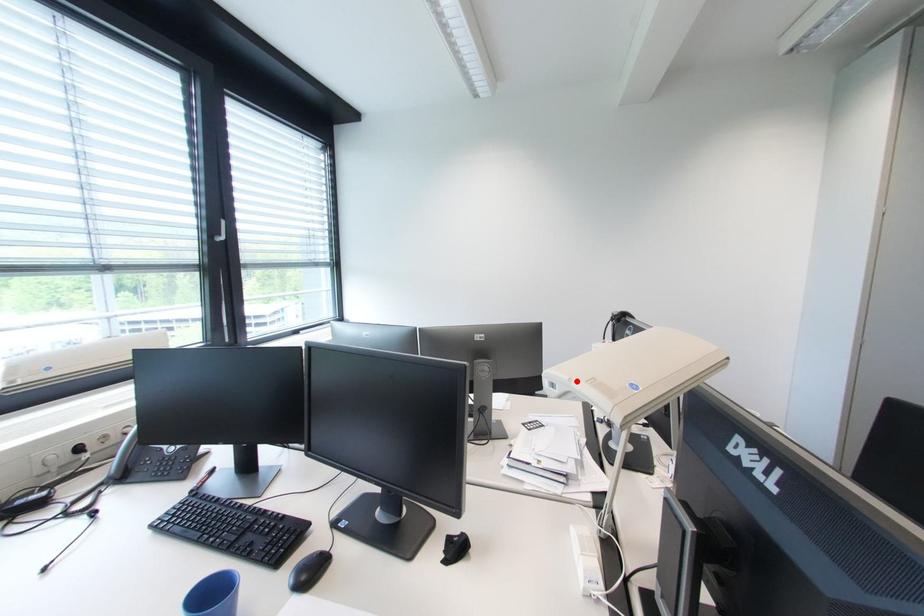
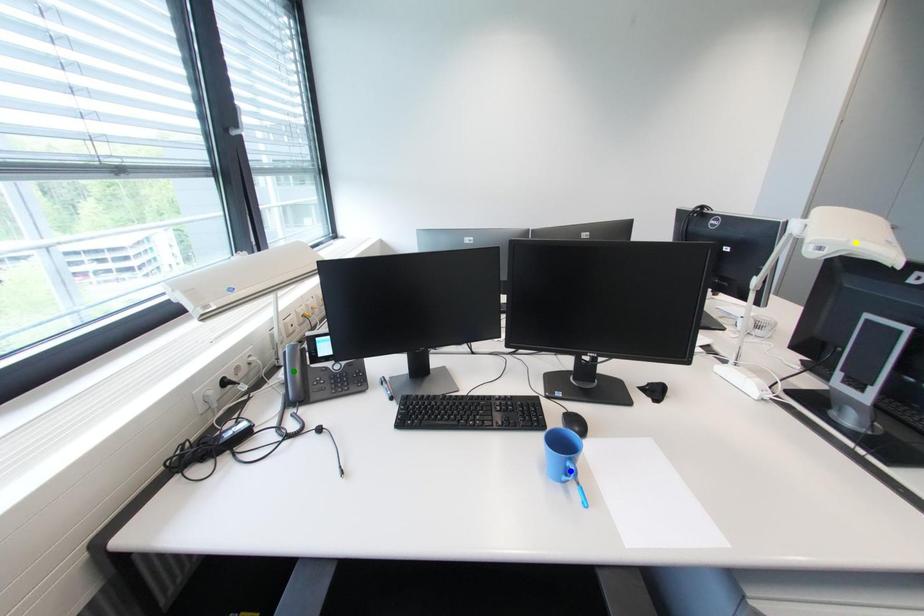
Question: I am providing you with two images of the same scene from different viewpoints. A red point is marked on the first image. You are given multiple points on the second image. Which point in image 2 represents the same 3d spot as the red point in image 1?

Choices:
 (A) blue point
 (B) yellow point
 (C) green point

Answer: (B)